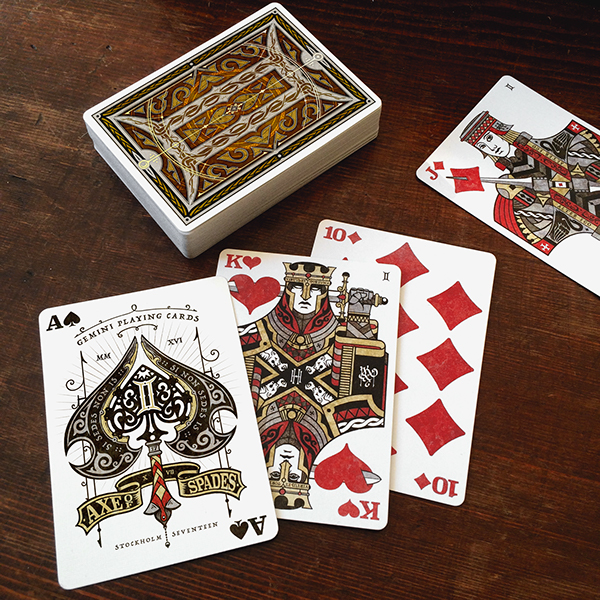
This screenshot has height=600, width=600. Identify the location of playing cards. (128, 475), (334, 395), (435, 373), (554, 212), (223, 144).